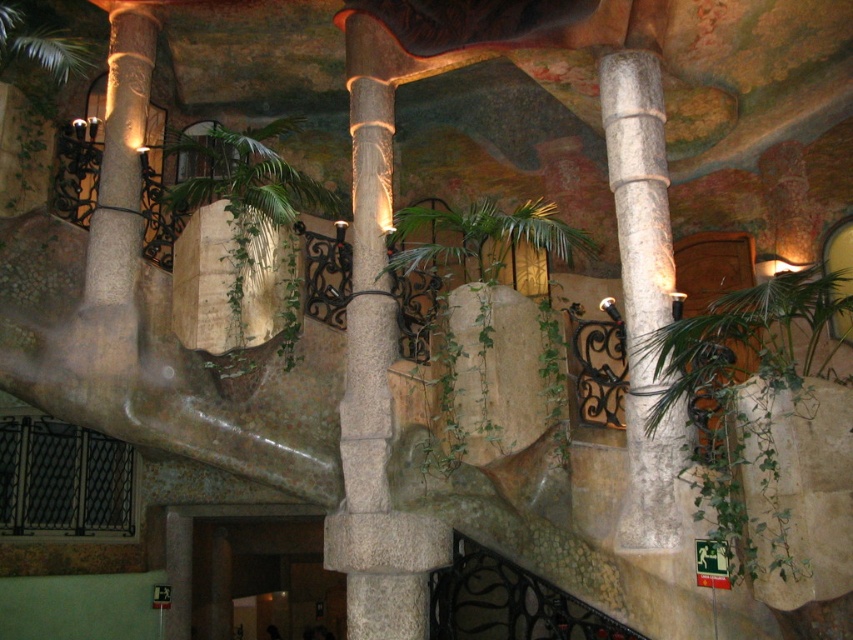
Question: Which point appears closest to the camera in this image?

Choices:
 (A) (647, 241)
 (B) (329, 212)

Answer: (A)

Question: Can you confirm if green leafy plant at center is smaller than white marble column at right?

Choices:
 (A) yes
 (B) no

Answer: (A)

Question: Based on their relative distances, which object is nearer to the green leafy plant at right?

Choices:
 (A) green leafy palm tree at center
 (B) green leafy plant at center
 (C) white marble column at right

Answer: (C)

Question: Can you confirm if green leafy plant at center is thinner than green leafy palm tree at center?

Choices:
 (A) no
 (B) yes

Answer: (B)

Question: Which point is closer to the camera?

Choices:
 (A) click(695, 397)
 (B) click(189, 189)
 (C) click(486, 246)
 (D) click(653, 381)

Answer: (A)

Question: Can you confirm if green leafy plant at right is positioned below green leafy palm tree at center?

Choices:
 (A) yes
 (B) no

Answer: (A)